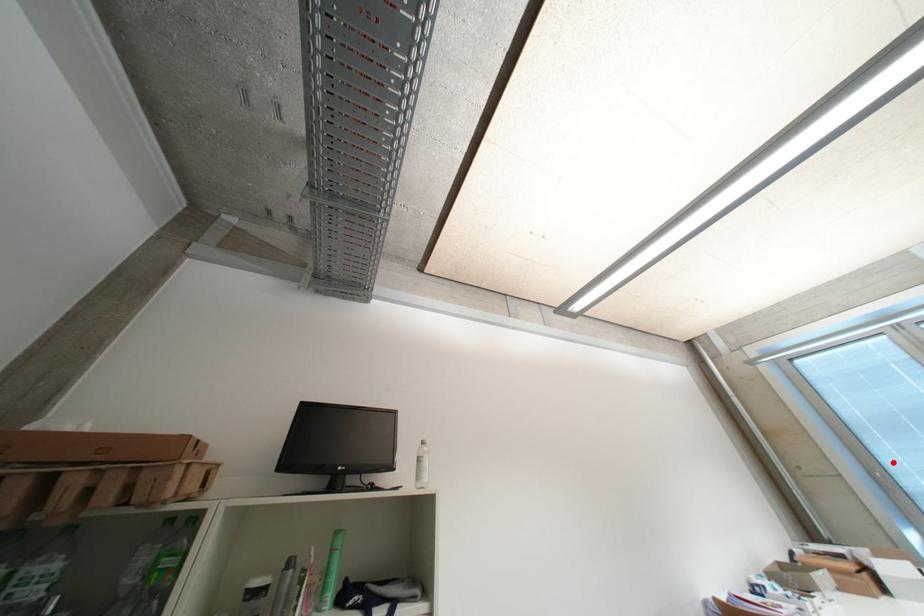
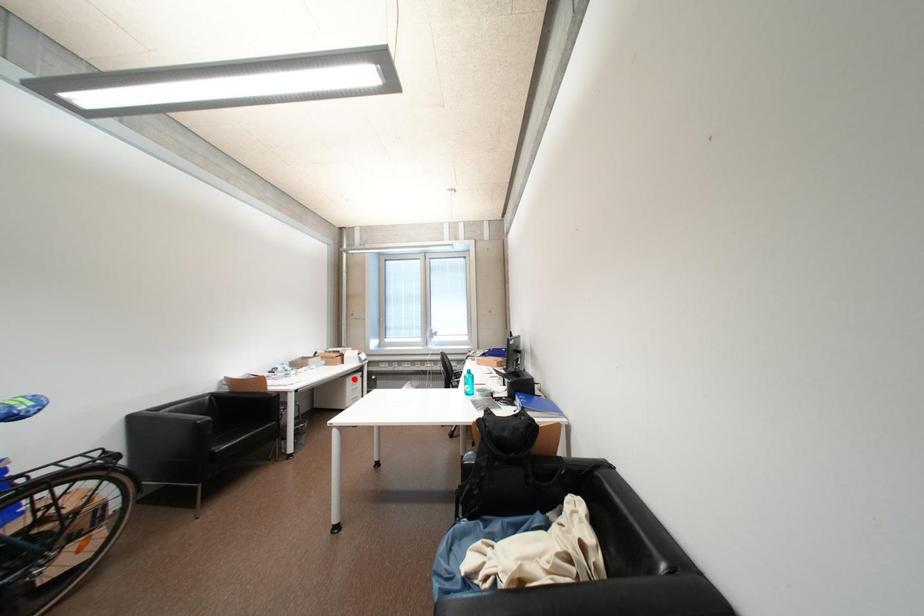
I am providing you with two images of the same scene from different viewpoints. A red point is marked on the first image and another point is marked on the second image. Does the point marked in image1 correspond to the same location as the one in image2?

No